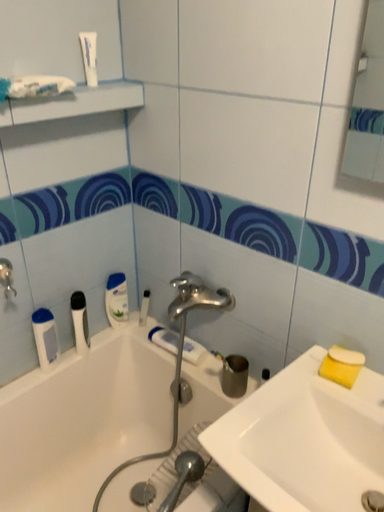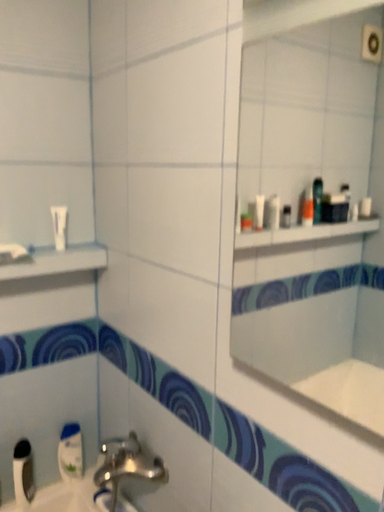
Question: Which way did the camera rotate in the video?

Choices:
 (A) rotated downward
 (B) rotated upward

Answer: (B)